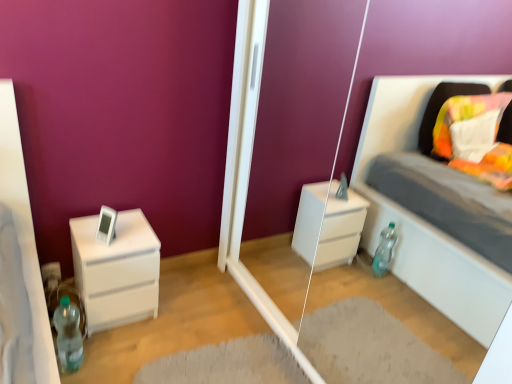
I want to click on vacant region above white matte chest of drawers at left (from a real-world perspective), so click(118, 235).